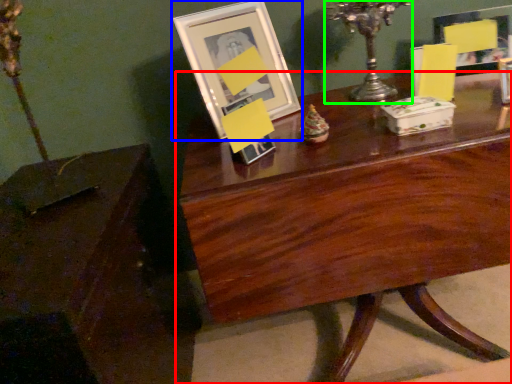
Question: Which object is positioned farthest from table (highlighted by a red box)? Select from picture frame (highlighted by a blue box) and candle holder (highlighted by a green box).

Choices:
 (A) picture frame
 (B) candle holder

Answer: (B)